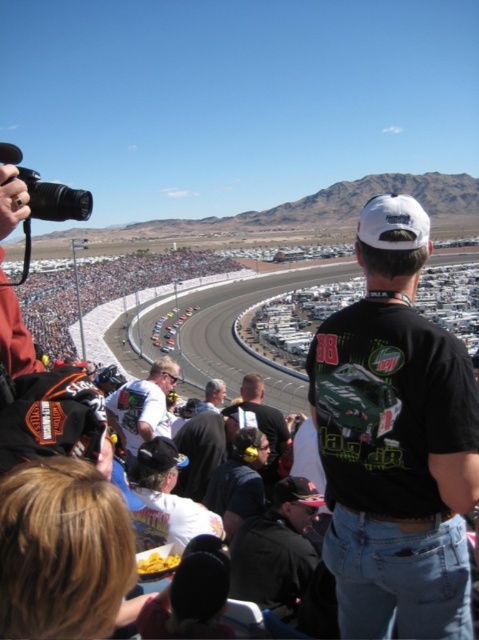
Can you confirm if matte black race car at center is shorter than matte black helmet at center?

No.

The width and height of the screenshot is (479, 640). What do you see at coordinates (146, 276) in the screenshot?
I see `matte black race car at center` at bounding box center [146, 276].

Find the location of `matte black race car at center`. matte black race car at center is located at coordinates coord(146,276).

Which is more to the right, black leather jacket at lower center or dark brown leather jacket at center?

From the viewer's perspective, dark brown leather jacket at center appears more on the right side.

Which is more to the left, black leather jacket at lower center or dark brown leather jacket at center?

black leather jacket at lower center is more to the left.

Is point (284, 508) in front of point (255, 428)?

Yes, it is in front of point (255, 428).

Locate an element on the screen. This screenshot has height=640, width=479. black leather jacket at lower center is located at coordinates (276, 548).

This screenshot has width=479, height=640. I want to click on black matte t-shirt at center, so click(x=396, y=442).

Is point (327, 465) farther from viewer compared to point (303, 563)?

No, it is in front of (303, 563).

I want to click on black matte t-shirt at center, so click(396, 442).